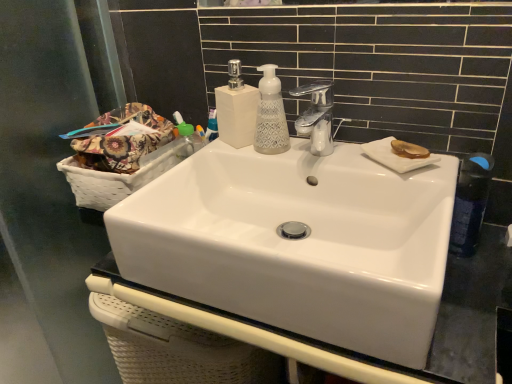
Based on the photo, measure the distance between white glossy sink at center and camera.

white glossy sink at center and camera are 54.01 centimeters apart from each other.

Where is `white glossy sink at center`? white glossy sink at center is located at coordinates coord(298,243).

Image resolution: width=512 pixels, height=384 pixels. I want to click on blue plastic mouthwash at upper center, so click(212, 126).

This screenshot has width=512, height=384. Describe the element at coordinates (409, 150) in the screenshot. I see `translucent amber plate at upper right` at that location.

What is the approximate width of white matte soap dispenser at center, which is the second soap dispenser from right to left?

It is 2.99 inches.

What do you see at coordinates (122, 140) in the screenshot? I see `floral fabric basket at left` at bounding box center [122, 140].

The image size is (512, 384). What are the coordinates of `white glossy sink at center` in the screenshot? It's located at (436, 321).

Is transparent glass screen door at left in front of translucent amber plate at upper right?

Yes, transparent glass screen door at left is closer to the camera.

Is transparent glass screen door at left positioned beyond the bounds of translucent amber plate at upper right?

transparent glass screen door at left lies outside translucent amber plate at upper right's area.

Does transparent glass screen door at left have a greater height compared to translucent amber plate at upper right?

Indeed, transparent glass screen door at left has a greater height compared to translucent amber plate at upper right.

Considering the points (4, 130) and (403, 156), which point is behind, point (4, 130) or point (403, 156)?

Point (4, 130)

How many degrees apart are the facing directions of chrome metallic faucet at upper center and white textured soap dispenser at center, placed as the second soap dispenser when sorted from left to right?

chrome metallic faucet at upper center and white textured soap dispenser at center, placed as the second soap dispenser when sorted from left to right, are facing 8.44 degrees away from each other.

Is chrome metallic faucet at upper center turned away from white textured soap dispenser at center, placed as the second soap dispenser when sorted from left to right?

No, chrome metallic faucet at upper center is not facing the opposite direction of white textured soap dispenser at center, placed as the second soap dispenser when sorted from left to right.

Is the surface of chrome metallic faucet at upper center in direct contact with white textured soap dispenser at center, placed as the second soap dispenser when sorted from left to right?

Yes, chrome metallic faucet at upper center is touching white textured soap dispenser at center, placed as the second soap dispenser when sorted from left to right.

Based on their sizes in the image, would you say chrome metallic faucet at upper center is bigger or smaller than white textured soap dispenser at center, placed as the second soap dispenser when sorted from left to right?

In the image, chrome metallic faucet at upper center appears to be larger than white textured soap dispenser at center, placed as the second soap dispenser when sorted from left to right.

Is transparent glass screen door at left next to white textured soap dispenser at center, placed as the second soap dispenser when sorted from left to right?

No, transparent glass screen door at left is not touching white textured soap dispenser at center, placed as the second soap dispenser when sorted from left to right.

Is transparent glass screen door at left taller or shorter than white textured soap dispenser at center, placed as the second soap dispenser when sorted from left to right?

In the image, transparent glass screen door at left appears to be taller than white textured soap dispenser at center, placed as the second soap dispenser when sorted from left to right.

Which object is wider, transparent glass screen door at left or white textured soap dispenser at center, placed as the second soap dispenser when sorted from left to right?

Wider between the two is white textured soap dispenser at center, placed as the second soap dispenser when sorted from left to right.

From the image's perspective, which is above, transparent glass screen door at left or white textured soap dispenser at center, placed as the second soap dispenser when sorted from left to right?

white textured soap dispenser at center, placed as the second soap dispenser when sorted from left to right, is shown above in the image.

Does white glossy sink at center have a smaller size compared to blue plastic mouthwash at upper center?

Actually, white glossy sink at center might be larger than blue plastic mouthwash at upper center.

Is white glossy sink at center to the right of blue plastic mouthwash at upper center from the viewer's perspective?

Yes.

Based on the photo, how many degrees apart are the facing directions of white glossy sink at center and blue plastic mouthwash at upper center?

The facing directions of white glossy sink at center and blue plastic mouthwash at upper center are 0.241 degrees apart.

Can you confirm if white glossy sink at center is shorter than blue plastic mouthwash at upper center?

Yes, white glossy sink at center is shorter than blue plastic mouthwash at upper center.

Which object is positioned more to the left, white glossy sink at center or transparent glass screen door at left?

transparent glass screen door at left.

Would you consider white glossy sink at center to be distant from transparent glass screen door at left?

No, white glossy sink at center is not far from transparent glass screen door at left.

Can you confirm if white glossy sink at center is wider than transparent glass screen door at left?

Yes, white glossy sink at center is wider than transparent glass screen door at left.

Is the depth of white glossy sink at center less than that of transparent glass screen door at left?

That is True.

From a real-world perspective, is blue plastic mouthwash at upper center positioned above or below translucent amber plate at upper right?

In terms of real-world spatial position, blue plastic mouthwash at upper center is below translucent amber plate at upper right.

Which object is thinner, blue plastic mouthwash at upper center or translucent amber plate at upper right?

With smaller width is blue plastic mouthwash at upper center.

Is blue plastic mouthwash at upper center not within translucent amber plate at upper right?

Indeed, blue plastic mouthwash at upper center is completely outside translucent amber plate at upper right.

Where is `counter top that appears on the left of translucent amber plate at upper right`? The width and height of the screenshot is (512, 384). counter top that appears on the left of translucent amber plate at upper right is located at coordinates (436, 321).

Would you say white glossy sink at center is a long distance from translucent amber plate at upper right?

No, white glossy sink at center is not far away from translucent amber plate at upper right.

How much distance is there between white glossy sink at center and translucent amber plate at upper right?

A distance of 12.31 inches exists between white glossy sink at center and translucent amber plate at upper right.

Based on the photo, from the image's perspective, is white glossy sink at center located above or below translucent amber plate at upper right?

Based on their image positions, white glossy sink at center is located beneath translucent amber plate at upper right.

Where is `screen door below the translucent amber plate at upper right (from the image's perspective)`? The width and height of the screenshot is (512, 384). screen door below the translucent amber plate at upper right (from the image's perspective) is located at coordinates (49, 180).

Starting from the chrome metallic faucet at upper center, which soap dispenser is the 1st one behind? Please provide its 2D coordinates.

[(271, 115)]

Considering their positions, is chrome metallic faucet at upper center positioned further to white glossy sink at center than blue plastic mouthwash at upper center?

blue plastic mouthwash at upper center is positioned further to the anchor white glossy sink at center.

Consider the image. From the image, which object appears to be nearer to white glossy sink at center, white textured soap dispenser at center, which is the 1th soap dispenser from right to left, or translucent amber plate at upper right?

translucent amber plate at upper right.

Looking at the image, which one is located further to white glossy sink at center, white textured soap dispenser at center, placed as the second soap dispenser when sorted from left to right, or floral fabric basket at left?

floral fabric basket at left is positioned further to the anchor white glossy sink at center.

Which object lies nearer to the anchor point floral fabric basket at left, white glossy sink at center or white woven basket at left?

Among the two, white woven basket at left is located nearer to floral fabric basket at left.

Based on their spatial positions, is white textured soap dispenser at center, which is the 1th soap dispenser from right to left, or floral fabric basket at left closer to blue plastic mouthwash at upper center?

Among the two, white textured soap dispenser at center, which is the 1th soap dispenser from right to left, is located nearer to blue plastic mouthwash at upper center.

From the image, which object appears to be nearer to chrome metallic faucet at upper center, white glossy sink at center or blue plastic mouthwash at upper center?

blue plastic mouthwash at upper center is closer to chrome metallic faucet at upper center.

Which object lies further to the anchor point white woven basket at left, white glossy sink at center or white textured soap dispenser at center, which is the 1th soap dispenser from right to left?

Based on the image, white glossy sink at center appears to be further to white woven basket at left.

Estimate the real-world distances between objects in this image. Which object is further from floral fabric basket at left, white matte soap dispenser at center, arranged as the 1th soap dispenser when viewed from the left, or white woven basket at left?

white matte soap dispenser at center, arranged as the 1th soap dispenser when viewed from the left, is positioned further to the anchor floral fabric basket at left.

What are the coordinates of `soap dispenser between white textured soap dispenser at center, placed as the second soap dispenser when sorted from left to right, and blue plastic mouthwash at upper center from front to back` in the screenshot? It's located at point(236,108).

Where is `soap dispenser between floral fabric basket at left and white textured soap dispenser at center, placed as the second soap dispenser when sorted from left to right`? This screenshot has width=512, height=384. soap dispenser between floral fabric basket at left and white textured soap dispenser at center, placed as the second soap dispenser when sorted from left to right is located at coordinates (236, 108).

Image resolution: width=512 pixels, height=384 pixels. In order to click on basket between floral fabric basket at left and white matte soap dispenser at center, which is the second soap dispenser from right to left, from left to right in this screenshot , I will do `click(124, 174)`.

At what (x,y) coordinates should I click in order to perform the action: click on sink located between transparent glass screen door at left and translucent amber plate at upper right in the left-right direction. Please return your answer as a coordinate pair (x, y). The image size is (512, 384). Looking at the image, I should click on (298, 243).